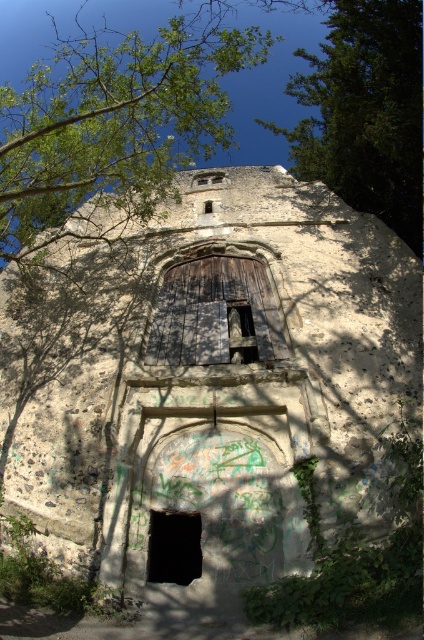
Can you confirm if green leafy tree at upper left is bigger than wooden door at center?

Indeed, green leafy tree at upper left has a larger size compared to wooden door at center.

Is green leafy tree at upper left taller than wooden door at center?

Yes, green leafy tree at upper left is taller than wooden door at center.

Measure the distance between point (211,35) and camera.

A distance of 41.30 feet exists between point (211,35) and camera.

In order to click on green leafy tree at upper left in this screenshot , I will do `click(114, 124)`.

Is green leafy tree at upper right smaller than wooden door at center?

Incorrect, green leafy tree at upper right is not smaller in size than wooden door at center.

Does green leafy tree at upper right appear on the left side of wooden door at center?

No, green leafy tree at upper right is not to the left of wooden door at center.

Which is behind, point (404, 61) or point (239, 317)?

The point (239, 317) is behind.

Find the location of a particular element. The width and height of the screenshot is (424, 640). green leafy tree at upper right is located at coordinates (365, 112).

Which of these two, green leafy tree at upper right or black matte window at lower center, stands shorter?

Standing shorter between the two is black matte window at lower center.

Who is more forward, (401, 198) or (189, 572)?

Point (189, 572) is in front.

I want to click on green leafy tree at upper right, so click(x=365, y=112).